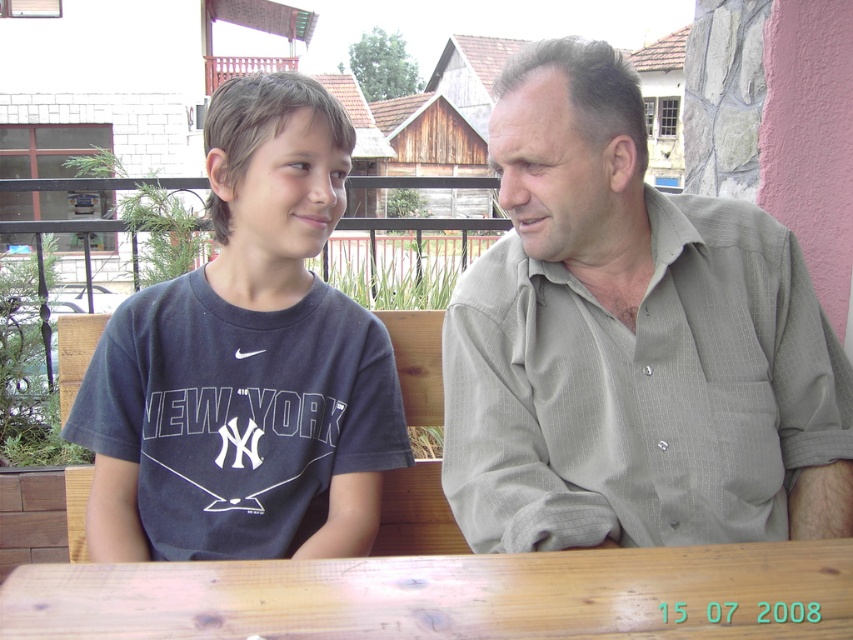
You are a photographer standing at a distance of 3 feet from the scene. You want to take a closeup shot of the gray textured shirt at upper right. Is the shirt within your camera range if your camera can focus as close as 3 feet?

The gray textured shirt at upper right is 3.35 feet away from viewer. Since the camera can focus as close as 3 feet, the shirt is slightly out of range. Move closer by 0.35 feet to capture it clearly.

You are a photographer trying to capture a portrait of both the gray textured shirt at upper right and the wooden table at center in the scene. Based on their positions, which object should you focus on first to ensure both are in frame?

The gray textured shirt at upper right is taller than the wooden table at center, so you should focus on the gray textured shirt at upper right first to ensure both are in frame.

You are standing 2 meters away from the wooden bench where the two people are sitting. You want to reach the point at coordinates point (775, 500) without getting too close to the people. Can you safely walk to that point?

The point at coordinates point (775, 500) is 1.26 meters away from the viewer. Since you are already standing 2 meters away from the wooden bench, you can safely walk to that point without getting too close to the people.